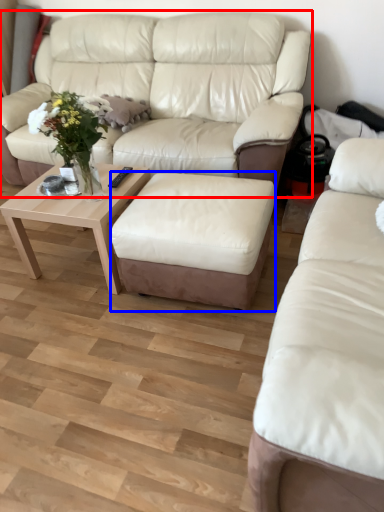
Question: Which object appears closest to the camera in this image, studio couch (highlighted by a red box) or stool (highlighted by a blue box)?

Choices:
 (A) studio couch
 (B) stool

Answer: (B)